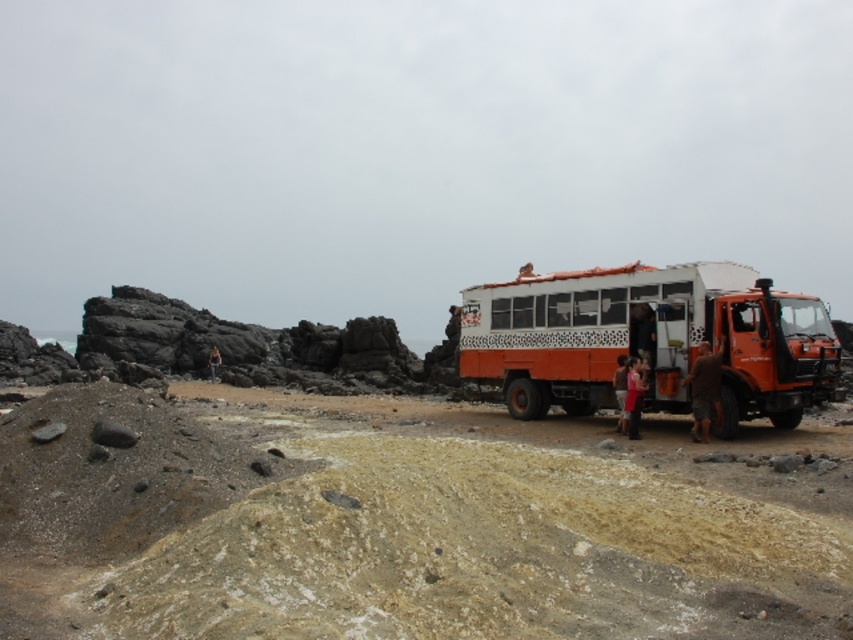
Question: From the image, what is the correct spatial relationship of red fabric shirt at center in relation to orange fabric person at center?

Choices:
 (A) left
 (B) right

Answer: (B)

Question: Can you confirm if red fabric shirt at center is bigger than orange fabric person at center?

Choices:
 (A) yes
 (B) no

Answer: (B)

Question: Can you confirm if red fabric shirt at center is positioned to the right of denim shorts at center?

Choices:
 (A) yes
 (B) no

Answer: (A)

Question: Which point is closer to the camera?

Choices:
 (A) (735, 536)
 (B) (210, 376)

Answer: (A)

Question: Estimate the real-world distances between objects in this image. Which object is closer to the denim shorts at center?

Choices:
 (A) orange matte truck at center
 (B) orange fabric person at center
 (C) smooth sand at center
 (D) brown fabric shorts at right

Answer: (A)

Question: Which object is positioned closest to the denim shorts at center?

Choices:
 (A) red fabric shirt at center
 (B) brown fabric shorts at right
 (C) orange fabric person at center

Answer: (C)